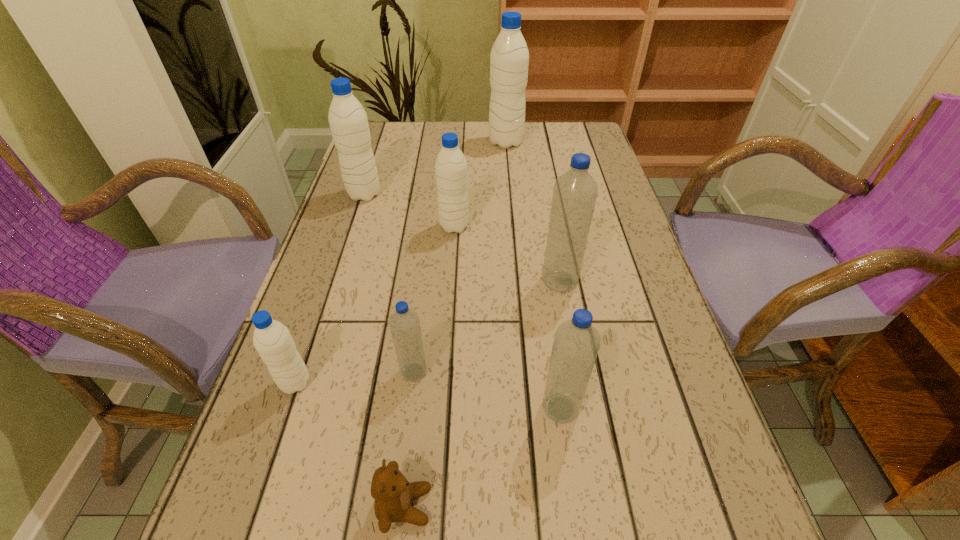
Locate which object ranks third in proximity to the second farthest water bottle. Please provide its 2D coordinates. Your answer should be formatted as a tuple, i.e. [(x, y)], where the tuple contains the x and y coordinates of a point satisfying the conditions above.

[(575, 192)]

I want to click on object that is the sixth nearest to the sixth nearest object, so click(576, 343).

Find the location of a particular element. The image size is (960, 540). the fourth closest water bottle relative to the leftmost blue water bottle is located at coordinates (451, 172).

Select which water bottle is the second closest to the nearest object. Please provide its 2D coordinates. Your answer should be formatted as a tuple, i.e. [(x, y)], where the tuple contains the x and y coordinates of a point satisfying the conditions above.

[(576, 343)]

I want to click on gray water bottle that can be found as the third closest to the second smallest gray water bottle, so click(272, 340).

The image size is (960, 540). What are the coordinates of `gray water bottle that stands as the third closest to the third farthest gray water bottle` in the screenshot? It's located at [272, 340].

The height and width of the screenshot is (540, 960). Find the location of `the second closest blue water bottle relative to the biggest gray water bottle`. the second closest blue water bottle relative to the biggest gray water bottle is located at coordinates (404, 323).

Identify which blue water bottle is the nearest to the farthest blue water bottle. Please provide its 2D coordinates. Your answer should be formatted as a tuple, i.e. [(x, y)], where the tuple contains the x and y coordinates of a point satisfying the conditions above.

[(576, 343)]

Locate an element on the screen. This screenshot has height=540, width=960. free space that satisfies the following two spatial constraints: 1. on the front side of the second biggest blue water bottle; 2. on the left side of the smallest gray water bottle is located at coordinates (287, 408).

The image size is (960, 540). Identify the location of free location that satisfies the following two spatial constraints: 1. on the back side of the second nearest blue water bottle; 2. on the right side of the third gray water bottle from left to right. (432, 226).